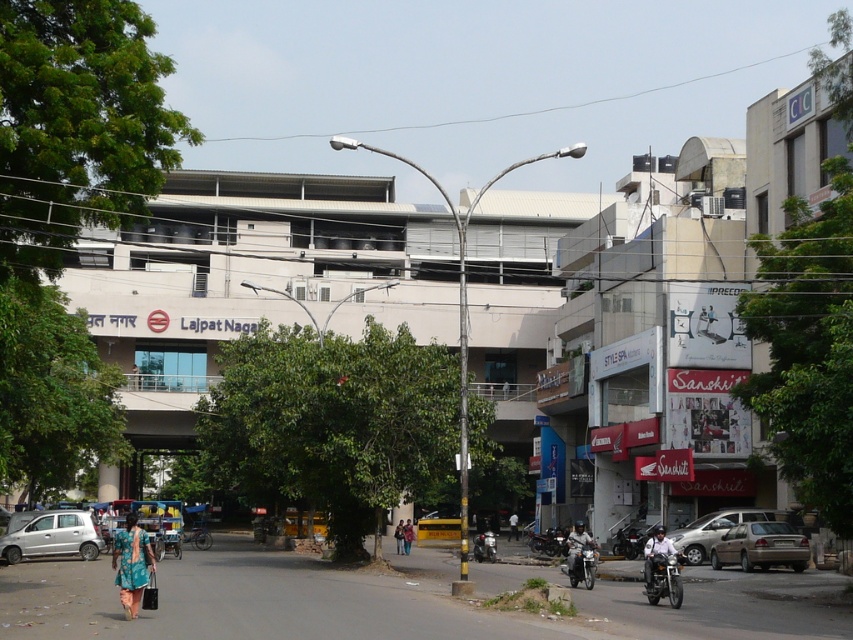
You are standing at the point marked by the coordinates point (715, 529) in the image. What object are you standing on?

The point (715, 529) marks the silver metallic sedan at lower right, so you are standing on the silver metallic sedan at lower right.

You are a delivery person who needs to load a tall package into your vehicle. You have a silver metallic sedan at lower right and a metallic silver motorcycle at lower right. Which vehicle can accommodate the tall package without damaging it?

The silver metallic sedan at lower right is taller than the metallic silver motorcycle at lower right, so the tall package can be safely loaded into the silver metallic sedan at lower right without damaging it.